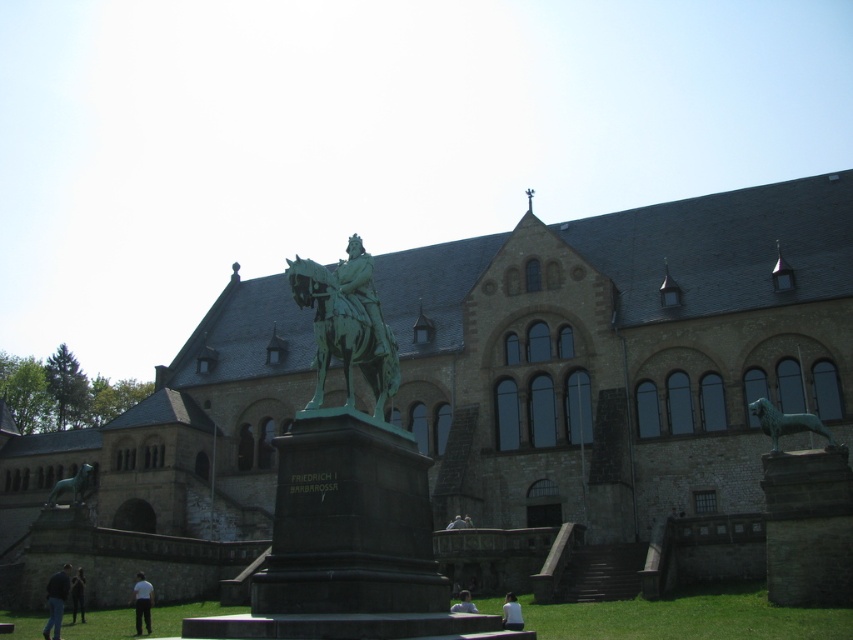
Is stone church at center below bronze horse statue at lower left?

Incorrect, stone church at center is not positioned below bronze horse statue at lower left.

Does point (671, 305) come closer to viewer compared to point (62, 490)?

That is False.

Identify the location of stone church at center. The image size is (853, 640). (622, 355).

Does stone church at center appear under light gray fabric pants at lower center?

Actually, stone church at center is above light gray fabric pants at lower center.

Between stone church at center and light gray fabric pants at lower center, which one appears on the right side from the viewer's perspective?

stone church at center

Where is `stone church at center`? The width and height of the screenshot is (853, 640). stone church at center is located at coordinates (622, 355).

What do you see at coordinates (346, 323) in the screenshot? The height and width of the screenshot is (640, 853). I see `green polished bronze statue at center` at bounding box center [346, 323].

Does green polished bronze statue at center appear under bronze horse at right?

Incorrect, green polished bronze statue at center is not positioned below bronze horse at right.

Does point (312, 304) lie in front of point (764, 432)?

Yes, point (312, 304) is in front of point (764, 432).

Locate an element on the screen. green polished bronze statue at center is located at coordinates (346, 323).